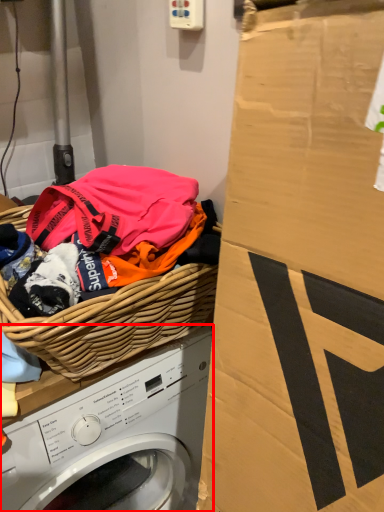
Question: Where is washing machine (annotated by the red box) located in relation to basket in the image?

Choices:
 (A) left
 (B) right

Answer: (A)